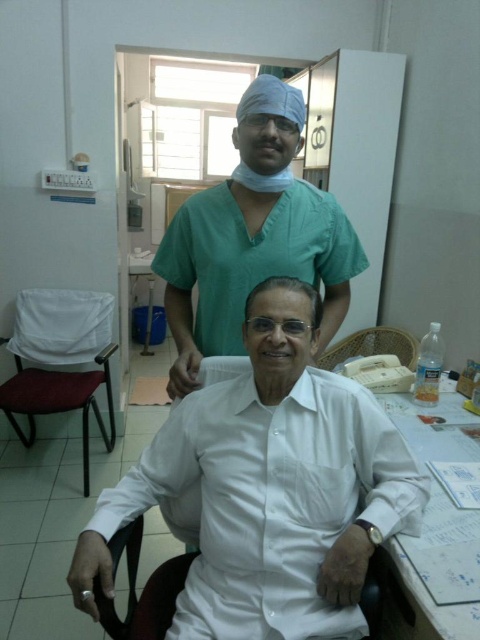
You are a delivery robot with a 0.5 meters wide package. You need to deliver this package to the doctor standing behind the seated man. Can you pass between the white smooth shirt at center and the medical professional to reach them?

The distance between the white smooth shirt at center and the medical professional is 1.01 meters. Since the package is 0.5 meters wide, the robot can pass through the space between them to deliver the package.

Consider the image. You are standing in the medical office and want to maintain a safe distance of at least 1.5 meters from the point marked at coordinates point (262,128). Are you currently within the safe distance?

The distance between you and point (262,128) is 1.32 meters, which is less than the required 1.5 meters. Therefore, you are not within the safe distance and should move further away.